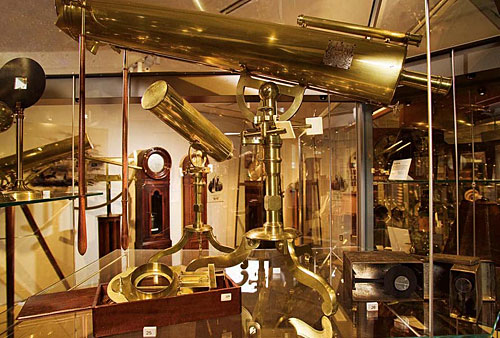
Find the location of a particular element. Image resolution: width=500 pixels, height=338 pixels. clock is located at coordinates (189, 208).